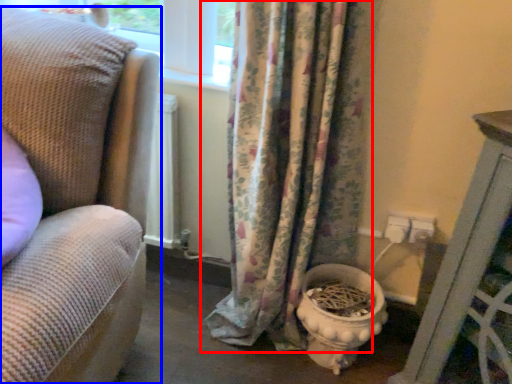
Question: Among these objects, which one is farthest to the camera, curtain (highlighted by a red box) or studio couch (highlighted by a blue box)?

Choices:
 (A) curtain
 (B) studio couch

Answer: (A)